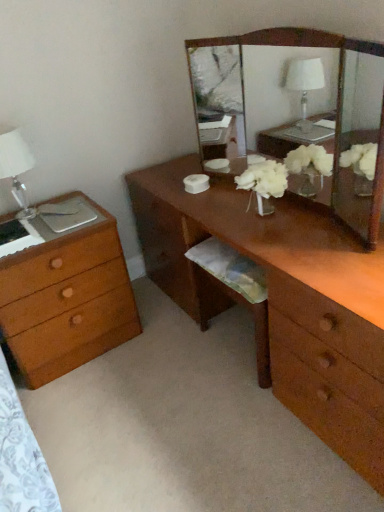
Question: Does point (9, 350) appear closer or farther from the camera than point (332, 300)?

Choices:
 (A) farther
 (B) closer

Answer: (A)

Question: From the image's perspective, is wooden chest of drawers at left above or below brown wooden desk at center?

Choices:
 (A) above
 (B) below

Answer: (B)

Question: Which object is positioned closest to the wooden chest of drawers at left?

Choices:
 (A) brown wooden desk at center
 (B) white glass table lamp at left
 (C) wooden mirror at center

Answer: (B)

Question: Estimate the real-world distances between objects in this image. Which object is closer to the brown wooden desk at center?

Choices:
 (A) white glass table lamp at left
 (B) wooden chest of drawers at left
 (C) wooden mirror at center

Answer: (B)